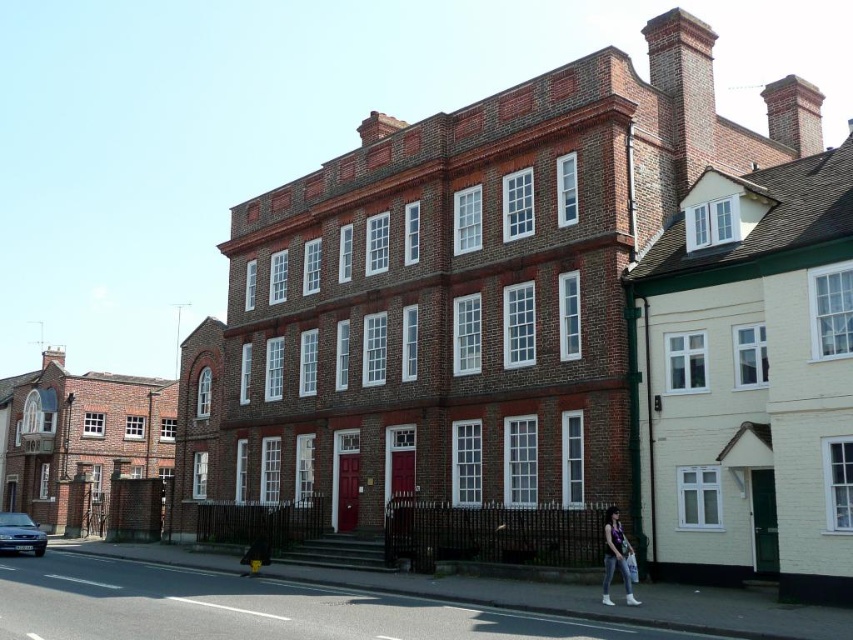
You are a delivery person trying to reach the front door of the building. You see the matte purple top at lower right and the metallic blue sedan at lower left. Which object is closer to you as you approach the building?

The matte purple top at lower right is closer to you because it is in front of the metallic blue sedan at lower left, meaning it is positioned nearer to your viewpoint as you approach the building.

You are standing in front of the three story brick building and see a matte purple top at lower right and a metallic blue sedan at lower left. Which vehicle is closer to the building entrance?

The metallic blue sedan at lower left is closer to the building entrance because the matte purple top at lower right is positioned on the right side of it, meaning the sedan is between the entrance and the top.

You are a delivery person trying to park your motorcycle between the matte purple top at lower right and the metallic blue sedan at lower left. Can you fit your motorcycle there?

The matte purple top at lower right occupies less space than metallic blue sedan at lower left, so there is enough space between them to park your motorcycle.